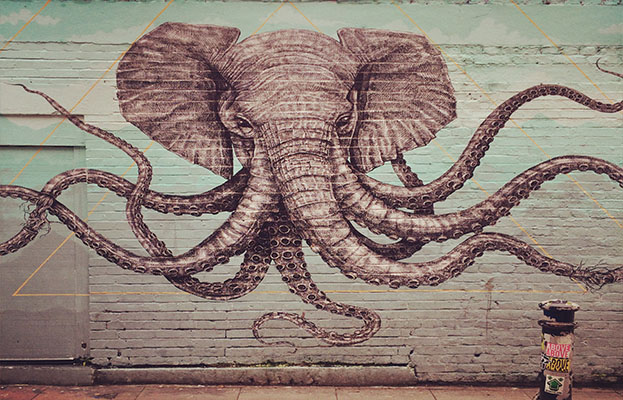
I want to click on cloud paintings, so click(x=101, y=38), click(x=488, y=37).